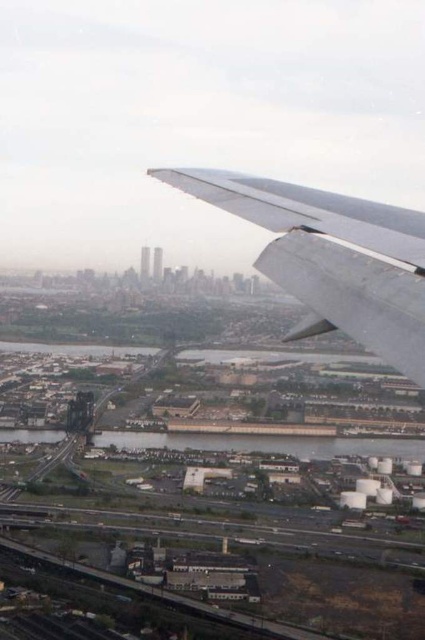
Question: Among these objects, which one is nearest to the camera?

Choices:
 (A) metallic gray waterway at lower center
 (B) metallic gray wing at upper right
 (C) metallic silver wing at upper right

Answer: (C)

Question: In this image, where is metallic gray wing at upper right located relative to metallic gray waterway at lower center?

Choices:
 (A) right
 (B) left

Answer: (A)

Question: Which object is closer to the camera taking this photo?

Choices:
 (A) metallic gray waterway at lower center
 (B) metallic silver wing at upper right

Answer: (B)

Question: Observing the image, what is the correct spatial positioning of metallic silver wing at upper right in reference to metallic gray waterway at lower center?

Choices:
 (A) left
 (B) right

Answer: (B)

Question: Can you confirm if metallic silver wing at upper right is smaller than metallic gray waterway at lower center?

Choices:
 (A) yes
 (B) no

Answer: (B)

Question: Estimate the real-world distances between objects in this image. Which object is closer to the metallic gray wing at upper right?

Choices:
 (A) metallic gray waterway at lower center
 (B) metallic silver wing at upper right

Answer: (B)